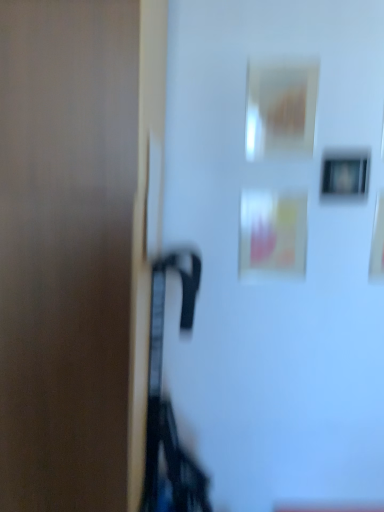
Where is `matte black picture frame at upper right`? This screenshot has height=512, width=384. matte black picture frame at upper right is located at coordinates (345, 174).

The height and width of the screenshot is (512, 384). Describe the element at coordinates (345, 174) in the screenshot. I see `matte black picture frame at upper right` at that location.

I want to click on matte brown door at left, so click(75, 247).

Describe the element at coordinates (75, 247) in the screenshot. The image size is (384, 512). I see `matte brown door at left` at that location.

The height and width of the screenshot is (512, 384). I want to click on matte black picture frame at upper right, so click(345, 174).

Considering the relative positions of matte black picture frame at upper right and matte brown door at left in the image provided, is matte black picture frame at upper right to the right of matte brown door at left from the viewer's perspective?

Correct, you'll find matte black picture frame at upper right to the right of matte brown door at left.

Considering the positions of objects matte black picture frame at upper right and matte brown door at left in the image provided, who is in front, matte black picture frame at upper right or matte brown door at left?

Positioned in front is matte brown door at left.

Considering the positions of points (356, 185) and (53, 164), is point (356, 185) closer to camera compared to point (53, 164)?

No, (356, 185) is further to viewer.

From the image's perspective, is matte black picture frame at upper right below matte brown door at left?

No, from the image's perspective, matte black picture frame at upper right is not below matte brown door at left.

From a real-world perspective, is matte black picture frame at upper right positioned under matte brown door at left based on gravity?

No, from a real-world perspective, matte black picture frame at upper right is not below matte brown door at left.

Which of these two, matte black picture frame at upper right or matte brown door at left, is thinner?

Thinner between the two is matte black picture frame at upper right.

Does matte black picture frame at upper right have a lesser height compared to matte brown door at left?

Yes.

Does matte black picture frame at upper right have a larger size compared to matte brown door at left?

No.

Does matte black picture frame at upper right contain matte brown door at left?

No, matte brown door at left is not inside matte black picture frame at upper right.

Is matte black picture frame at upper right in contact with matte brown door at left?

No, matte black picture frame at upper right is not next to matte brown door at left.

Does matte black picture frame at upper right turn towards matte brown door at left?

No, matte black picture frame at upper right is not aimed at matte brown door at left.

How different are the orientations of matte black picture frame at upper right and matte brown door at left in degrees?

matte black picture frame at upper right and matte brown door at left are facing 1.98 degrees away from each other.

Find the location of a particular element. The height and width of the screenshot is (512, 384). picture frame above the matte brown door at left (from the image's perspective) is located at coordinates (345, 174).

Is matte brown door at left to the left of matte black picture frame at upper right from the viewer's perspective?

Correct, you'll find matte brown door at left to the left of matte black picture frame at upper right.

Considering their positions, is matte brown door at left located in front of or behind matte black picture frame at upper right?

matte brown door at left is in front of matte black picture frame at upper right.

Is point (3, 394) closer or farther from the camera than point (366, 192)?

Point (3, 394) appears to be closer to the viewer than point (366, 192).

From the image's perspective, between matte brown door at left and matte black picture frame at upper right, who is located below?

From the image's view, matte brown door at left is below.

From a real-world perspective, is matte brown door at left under matte black picture frame at upper right?

Yes.

Between matte brown door at left and matte black picture frame at upper right, which one has smaller width?

matte black picture frame at upper right is thinner.

Is matte brown door at left taller or shorter than matte black picture frame at upper right?

Considering their sizes, matte brown door at left has more height than matte black picture frame at upper right.

Is matte brown door at left bigger than matte black picture frame at upper right?

Yes, matte brown door at left is bigger than matte black picture frame at upper right.

Choose the correct answer: Is matte brown door at left inside matte black picture frame at upper right or outside it?

matte brown door at left is located beyond the bounds of matte black picture frame at upper right.

Can you see matte brown door at left touching matte black picture frame at upper right?

No, matte brown door at left is not beside matte black picture frame at upper right.

Is matte brown door at left turned away from matte black picture frame at upper right?

No.

What's the angular difference between matte brown door at left and matte black picture frame at upper right's facing directions?

The angular difference between matte brown door at left and matte black picture frame at upper right is 1.98 degrees.

I want to click on door below the matte black picture frame at upper right (from a real-world perspective), so pos(75,247).

Where is `door beneath the matte black picture frame at upper right (from a real-world perspective)`? This screenshot has width=384, height=512. door beneath the matte black picture frame at upper right (from a real-world perspective) is located at coordinates (75, 247).

You are a GUI agent. You are given a task and a screenshot of the screen. Output one action in this format:
    pyautogui.click(x=<x>, y=<y>)
    Task: Click on the door on the left of matte black picture frame at upper right
    This screenshot has height=512, width=384.
    Given the screenshot: What is the action you would take?
    pyautogui.click(x=75, y=247)